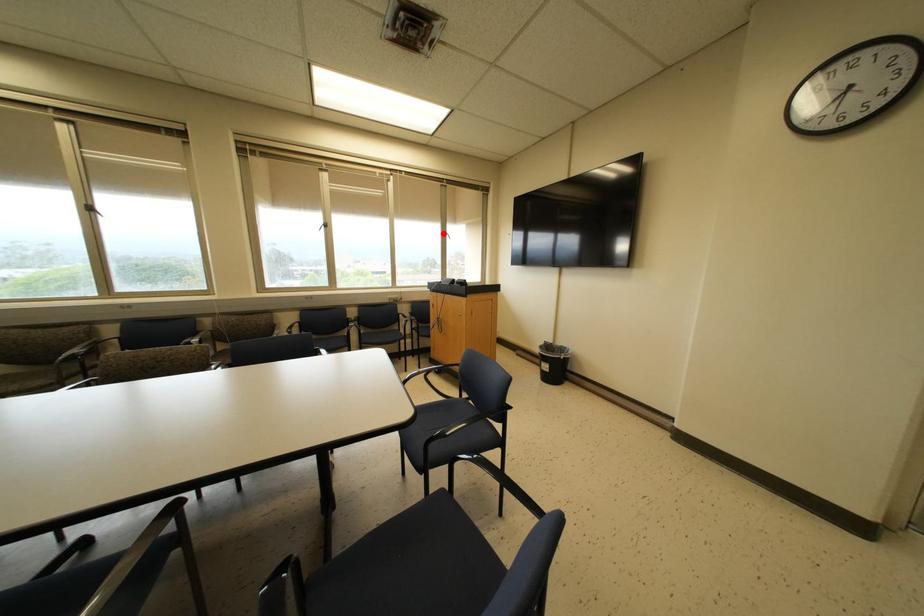
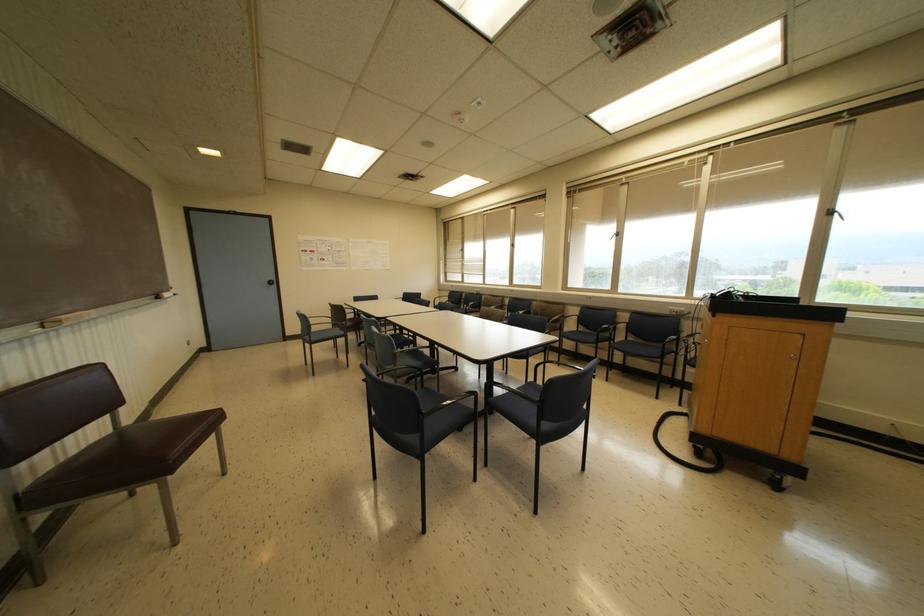
Question: I am providing you with two images of the same scene from different viewpoints. A red point is shown in image1. For the corresponding object point in image2, is it positioned nearer or farther from the camera?

Choices:
 (A) Nearer
 (B) Farther

Answer: (B)